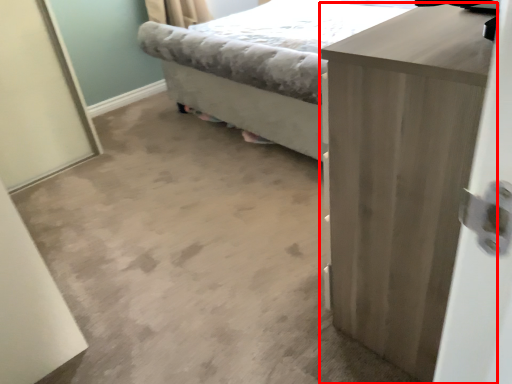
Question: From the image, what is the correct spatial relationship of chest of drawers (annotated by the red box) in relation to bed?

Choices:
 (A) right
 (B) left

Answer: (B)